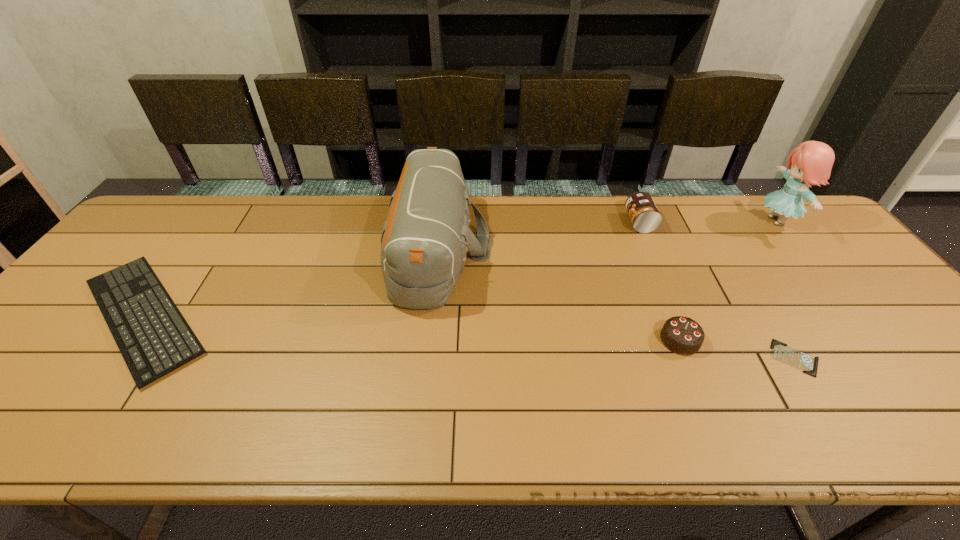
This screenshot has height=540, width=960. I want to click on free location located on the front-facing side of the tallest object, so click(630, 221).

Find the location of a particular element. The height and width of the screenshot is (540, 960). vacant space situated on the right of the second tallest object is located at coordinates (608, 248).

You are a GUI agent. You are given a task and a screenshot of the screen. Output one action in this format:
    pyautogui.click(x=<x>, y=<y>)
    Task: Click on the vacant space located on the front label of the fourth shortest object
    Image resolution: width=960 pixels, height=540 pixels.
    Given the screenshot: What is the action you would take?
    pyautogui.click(x=518, y=222)

Locate an element on the screen. The image size is (960, 540). vacant space situated 0.060m on the front label of the fourth shortest object is located at coordinates (608, 222).

Image resolution: width=960 pixels, height=540 pixels. Identify the location of free space located on the front label of the fourth shortest object. pos(601,222).

Locate an element on the screen. This screenshot has width=960, height=540. free space located on the front of the fourth tallest object is located at coordinates (699, 386).

At what (x,y) coordinates should I click in order to perform the action: click on vacant region located on the left of the identity card. Please return your answer as a coordinate pair (x, y). Looking at the image, I should click on (725, 358).

Locate an element on the screen. This screenshot has width=960, height=540. doll located at the far edge is located at coordinates 811,162.

I want to click on duffel bag located in the far edge section of the desktop, so click(x=424, y=239).

Identify the location of can located in the far edge section of the desktop. (645, 217).